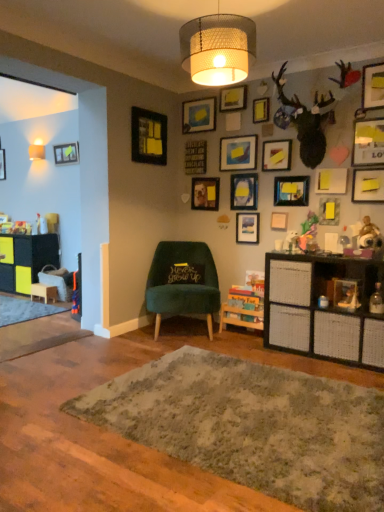
Measure the distance between point (153, 258) and camera.

Point (153, 258) is 13.43 feet from camera.

The height and width of the screenshot is (512, 384). What do you see at coordinates (324, 308) in the screenshot? I see `black plastic shelf at right` at bounding box center [324, 308].

Where is `textured gray rug at center`? textured gray rug at center is located at coordinates (252, 426).

Measure the distance between textured gray rug at center and camera.

textured gray rug at center is 1.55 meters away from camera.

This screenshot has width=384, height=512. Describe the element at coordinates (329, 211) in the screenshot. I see `yellow matte picture frame at upper right, marked as the 13th picture frame in a left-to-right arrangement` at that location.

In order to face yellow matte picture frame at upper right, the sixteenth picture frame positioned from the left, should I rotate leftwards or rightwards?

Turn right approximately 22.889 degrees to face it.

I want to click on wooden table at lower left, so click(44, 292).

From the image's perspective, who appears lower, wooden table at lower left or yellow matte picture frame at upper center, the 9th picture frame viewed from the right?

From the image's view, wooden table at lower left is below.

Is wooden table at lower left not inside yellow matte picture frame at upper center, which is the ninth picture frame from left to right?

wooden table at lower left lies outside yellow matte picture frame at upper center, which is the ninth picture frame from left to right,'s area.

Is point (46, 288) closer or farther from the camera than point (269, 98)?

Point (46, 288).

Is wooden table at lower left oriented away from yellow matte picture frame at upper center, which is the ninth picture frame from left to right?

No, wooden table at lower left is not facing the opposite direction of yellow matte picture frame at upper center, which is the ninth picture frame from left to right.

Is matte black picture frame at upper left, the seventeenth picture frame when ordered from right to left, thinner than wooden table at lower left?

Correct, the width of matte black picture frame at upper left, the seventeenth picture frame when ordered from right to left, is less than that of wooden table at lower left.

Is matte black picture frame at upper left, the seventeenth picture frame when ordered from right to left, further to the viewer compared to wooden table at lower left?

Yes, matte black picture frame at upper left, the seventeenth picture frame when ordered from right to left, is further from the camera.

In the scene shown: Is matte black picture frame at upper left, placed as the 1th picture frame when sorted from left to right, not near wooden table at lower left?

matte black picture frame at upper left, placed as the 1th picture frame when sorted from left to right, is far away from wooden table at lower left.

From the image's perspective, is matte black picture frame at upper left, the seventeenth picture frame when ordered from right to left, located above yellow matte picture frame at upper center, which is the ninth picture frame from left to right?

No, from the image's perspective, matte black picture frame at upper left, the seventeenth picture frame when ordered from right to left, is not on top of yellow matte picture frame at upper center, which is the ninth picture frame from left to right.

Considering the positions of point (59, 155) and point (254, 108), is point (59, 155) closer or farther from the camera than point (254, 108)?

Point (59, 155) is positioned farther from the camera compared to point (254, 108).

Considering the sizes of objects matte black picture frame at upper left, placed as the 1th picture frame when sorted from left to right, and yellow matte picture frame at upper center, the 9th picture frame viewed from the right, in the image provided, who is taller, matte black picture frame at upper left, placed as the 1th picture frame when sorted from left to right, or yellow matte picture frame at upper center, the 9th picture frame viewed from the right,?

matte black picture frame at upper left, placed as the 1th picture frame when sorted from left to right.

Between matte black picture frame at upper left, the seventeenth picture frame when ordered from right to left, and yellow matte picture frame at upper center, the 9th picture frame viewed from the right, which one has smaller width?

yellow matte picture frame at upper center, the 9th picture frame viewed from the right.

Is there a large distance between matte white lampshade at upper left, which ranks as the first lamp in left-to-right order, and matte black picture frame at upper right, which is the twelfth picture frame in left-to-right order?

Yes, matte white lampshade at upper left, which ranks as the first lamp in left-to-right order, and matte black picture frame at upper right, which is the twelfth picture frame in left-to-right order, are quite far apart.

Who is smaller, matte white lampshade at upper left, acting as the first lamp starting from the back, or matte black picture frame at upper right, which is the twelfth picture frame in left-to-right order?

matte black picture frame at upper right, which is the twelfth picture frame in left-to-right order.

From their relative heights in the image, would you say matte white lampshade at upper left, which ranks as the first lamp in left-to-right order, is taller or shorter than matte black picture frame at upper right, the 6th picture frame when ordered from right to left?

Clearly, matte white lampshade at upper left, which ranks as the first lamp in left-to-right order, is shorter compared to matte black picture frame at upper right, the 6th picture frame when ordered from right to left.

Is point (31, 158) closer or farther from the camera than point (290, 184)?

Point (31, 158).

From a real-world perspective, is matte wooden picture frame at center, which is the fourth picture frame in left-to-right order, physically located above or below matte blue picture frame at upper center, arranged as the tenth picture frame when viewed from the right?

In terms of real-world spatial position, matte wooden picture frame at center, which is the fourth picture frame in left-to-right order, is above matte blue picture frame at upper center, arranged as the tenth picture frame when viewed from the right.

Which of these two, matte wooden picture frame at center, placed as the 14th picture frame when sorted from right to left, or matte blue picture frame at upper center, arranged as the tenth picture frame when viewed from the right, is thinner?

Thinner between the two is matte blue picture frame at upper center, arranged as the tenth picture frame when viewed from the right.

Looking at this image, is matte wooden picture frame at center, placed as the 14th picture frame when sorted from right to left, placed right next to matte blue picture frame at upper center, arranged as the tenth picture frame when viewed from the right?

No, matte wooden picture frame at center, placed as the 14th picture frame when sorted from right to left, is not with matte blue picture frame at upper center, arranged as the tenth picture frame when viewed from the right.

How different are the orientations of matte wooden picture frame at center, placed as the 14th picture frame when sorted from right to left, and matte blue picture frame at upper center, arranged as the tenth picture frame when viewed from the right, in degrees?

0.478 degrees separate the facing orientations of matte wooden picture frame at center, placed as the 14th picture frame when sorted from right to left, and matte blue picture frame at upper center, arranged as the tenth picture frame when viewed from the right.

Could matte black picture frame at upper center, marked as the sixteenth picture frame in a right-to-left arrangement, be considered to be inside matte wooden picture frame at center, which is the fourth picture frame in left-to-right order?

Definitely not — matte black picture frame at upper center, marked as the sixteenth picture frame in a right-to-left arrangement, is not inside matte wooden picture frame at center, which is the fourth picture frame in left-to-right order.

From the image's perspective, is matte wooden picture frame at center, which is the fourth picture frame in left-to-right order, located above or below matte black picture frame at upper center, acting as the 2th picture frame starting from the left?

Based on their image positions, matte wooden picture frame at center, which is the fourth picture frame in left-to-right order, is located beneath matte black picture frame at upper center, acting as the 2th picture frame starting from the left.

Is matte wooden picture frame at center, placed as the 14th picture frame when sorted from right to left, oriented away from matte black picture frame at upper center, marked as the sixteenth picture frame in a right-to-left arrangement?

matte wooden picture frame at center, placed as the 14th picture frame when sorted from right to left, is not turned away from matte black picture frame at upper center, marked as the sixteenth picture frame in a right-to-left arrangement.

Which of these two, matte black picture frame at upper center, the 7th picture frame when ordered from right to left, or matte wooden picture frame at center, placed as the 14th picture frame when sorted from right to left, stands taller?

matte wooden picture frame at center, placed as the 14th picture frame when sorted from right to left.

Which object is wider, matte black picture frame at upper center, the eleventh picture frame when ordered from left to right, or matte wooden picture frame at center, placed as the 14th picture frame when sorted from right to left?

matte black picture frame at upper center, the eleventh picture frame when ordered from left to right.

From the image's perspective, which object appears higher, matte black picture frame at upper center, the eleventh picture frame when ordered from left to right, or matte wooden picture frame at center, which is the fourth picture frame in left-to-right order?

matte wooden picture frame at center, which is the fourth picture frame in left-to-right order, appears higher in the image.

Which is behind, point (278, 220) or point (211, 193)?

Positioned behind is point (211, 193).

Find the location of a particular element. table behind the yellow matte picture frame at upper center, which is the ninth picture frame from left to right is located at coordinates (44, 292).

You are a GUI agent. You are given a task and a screenshot of the screen. Output one action in this format:
    pyautogui.click(x=<x>, y=<y>)
    Task: Click on the table lying in front of the matte black picture frame at upper left, placed as the 1th picture frame when sorted from left to right
    
    Given the screenshot: What is the action you would take?
    pyautogui.click(x=44, y=292)

From the picture: Estimate the real-world distances between objects in this image. Which object is closer to matte black picture frame at upper right, the 6th picture frame when ordered from right to left, yellow matte cabinet at left or matte wooden picture frame at center, placed as the 14th picture frame when sorted from right to left?

matte wooden picture frame at center, placed as the 14th picture frame when sorted from right to left, is closer to matte black picture frame at upper right, the 6th picture frame when ordered from right to left.

Which object lies nearer to the anchor point yellow matte picture frame at upper center, which is the ninth picture frame from left to right, black plastic shelf at right or yellow paper at upper right, placed as the 4th picture frame when sorted from right to left?

yellow paper at upper right, placed as the 4th picture frame when sorted from right to left, lies closer to yellow matte picture frame at upper center, which is the ninth picture frame from left to right, than the other object.

Estimate the real-world distances between objects in this image. Which object is further from black plastic shelf at right, matte blue picture frame at upper center, arranged as the eighth picture frame when viewed from the left, or matte black picture frame at upper left, placed as the 1th picture frame when sorted from left to right?

matte black picture frame at upper left, placed as the 1th picture frame when sorted from left to right, lies further to black plastic shelf at right than the other object.

Based on their spatial positions, is matte wooden picture frame at center, placed as the 14th picture frame when sorted from right to left, or matte black picture frame at upper right, which is the third picture frame in right-to-left order, further from matte black picture frame at upper right, the 6th picture frame when ordered from right to left?

The object further to matte black picture frame at upper right, the 6th picture frame when ordered from right to left, is matte black picture frame at upper right, which is the third picture frame in right-to-left order.

Considering their positions, is matte yellow picture frame at upper center, which is counted as the 3th picture frame, starting from the left, positioned further to matte black picture frame at upper right, marked as the 15th picture frame in a left-to-right arrangement, than wooden table at lower left?

wooden table at lower left.

Considering their positions, is yellow matte picture frame at upper right, the sixteenth picture frame positioned from the left, positioned closer to yellow matte picture frame at upper right, marked as the 13th picture frame in a left-to-right arrangement, than woven beige lampshade at upper center, the 2th lamp viewed from the back?

yellow matte picture frame at upper right, the sixteenth picture frame positioned from the left.

Which object lies further to the anchor point yellow paper at upper right, marked as the 14th picture frame in a left-to-right arrangement, matte black picture frame at upper right, which is the twelfth picture frame in left-to-right order, or woven beige lampshade at upper center, the first lamp positioned from the right?

Among the two, woven beige lampshade at upper center, the first lamp positioned from the right, is located further to yellow paper at upper right, marked as the 14th picture frame in a left-to-right arrangement.

Which object lies further to the anchor point matte black picture frame at upper center, the 7th picture frame when ordered from right to left, yellow paper at upper right, marked as the 14th picture frame in a left-to-right arrangement, or matte blue picture frame at upper center, arranged as the tenth picture frame when viewed from the right?

Based on the image, yellow paper at upper right, marked as the 14th picture frame in a left-to-right arrangement, appears to be further to matte black picture frame at upper center, the 7th picture frame when ordered from right to left.

You are a GUI agent. You are given a task and a screenshot of the screen. Output one action in this format:
    pyautogui.click(x=<x>, y=<y>)
    Task: Click on the shelf between textured gray rug at center and matte blue picture frame at upper center, arranged as the 7th picture frame when viewed from the left, from front to back
    The image size is (384, 512).
    Given the screenshot: What is the action you would take?
    pyautogui.click(x=324, y=308)

Locate an element on the screen. The image size is (384, 512). table situated between matte white lampshade at upper left, acting as the first lamp starting from the back, and yellow matte picture frame at upper right, the fifth picture frame in the right-to-left sequence, from left to right is located at coordinates (44, 292).

You are a GUI agent. You are given a task and a screenshot of the screen. Output one action in this format:
    pyautogui.click(x=<x>, y=<y>)
    Task: Click on the table between yellow matte cabinet at left and yellow matte picture frame at upper right, which ranks as the 10th picture frame in left-to-right order, in the horizontal direction
    The height and width of the screenshot is (512, 384).
    Given the screenshot: What is the action you would take?
    44,292

Locate an element on the screen. shelf located between velvet green chair at center and yellow matte picture frame at upper right, marked as the 13th picture frame in a left-to-right arrangement, in the left-right direction is located at coordinates (324, 308).